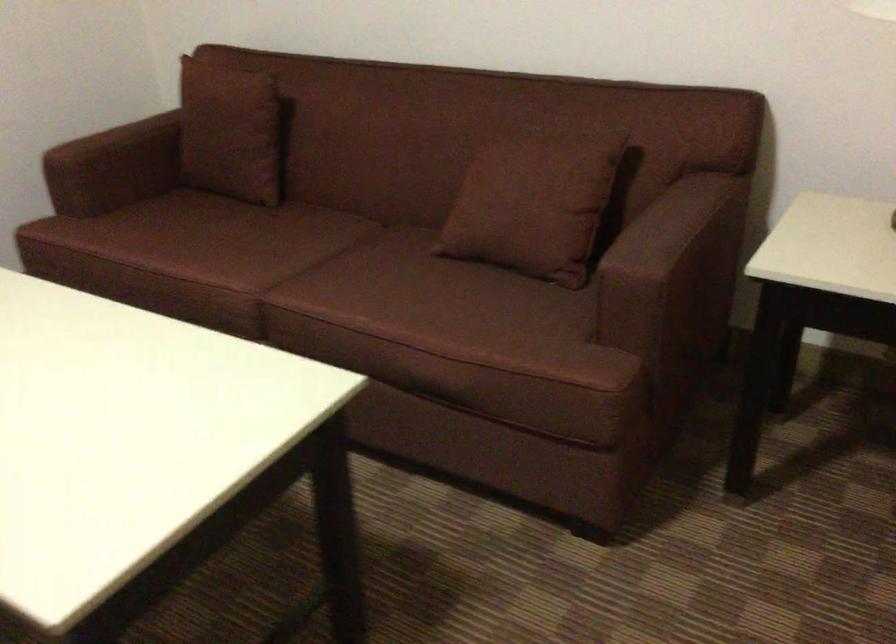
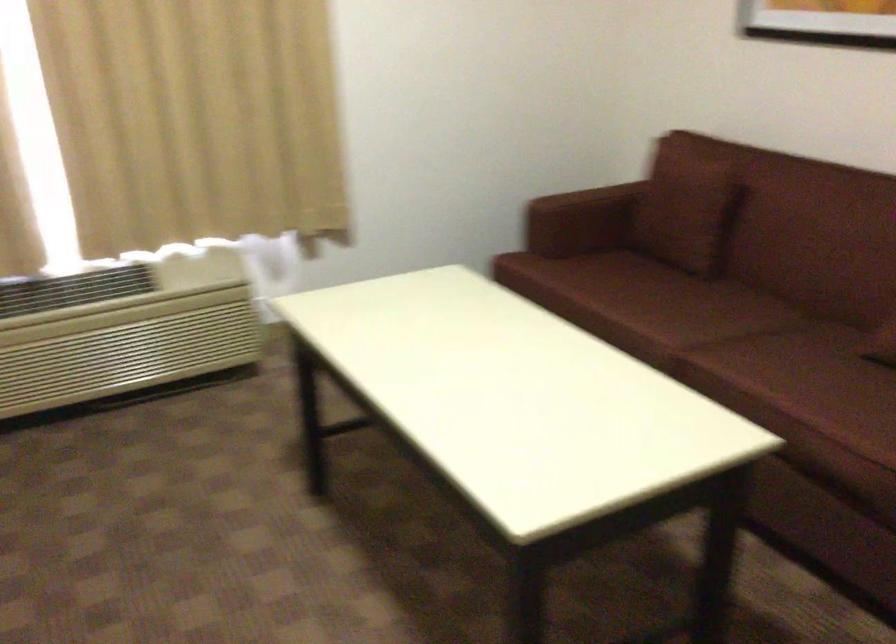
Question: In a continuous first-person perspective shot, in which direction is the camera moving?

Choices:
 (A) Left
 (B) Right
 (C) Forward
 (D) Backward

Answer: (D)